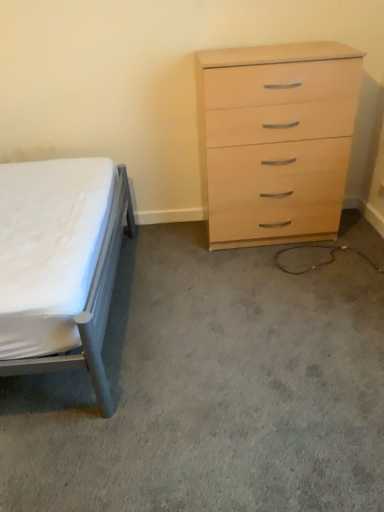
Measure the distance between point [219,254] and camera.

The depth of point [219,254] is 8.20 feet.

Where is `matte gray bed at left`? matte gray bed at left is located at coordinates (60, 264).

Where is `light wood/veneer chest of drawers at right`? Image resolution: width=384 pixels, height=512 pixels. light wood/veneer chest of drawers at right is located at coordinates (278, 134).

From the image's perspective, does light wood/veneer chest of drawers at right appear lower than matte gray bed at left?

Actually, light wood/veneer chest of drawers at right appears above matte gray bed at left in the image.

Considering the relative sizes of light wood/veneer chest of drawers at right and matte gray bed at left in the image provided, is light wood/veneer chest of drawers at right thinner than matte gray bed at left?

Yes, light wood/veneer chest of drawers at right is thinner than matte gray bed at left.

From a real-world perspective, between light wood/veneer chest of drawers at right and matte gray bed at left, who is vertically lower?

matte gray bed at left is physically lower.

Measure the distance from matte gray bed at left to white fabric bed at left.

They are 20.34 inches apart.

Is matte gray bed at left facing away from white fabric bed at left?

No, matte gray bed at left is not facing away from white fabric bed at left.

I want to click on bed in front of the white fabric bed at left, so click(x=60, y=264).

Considering the positions of objects matte gray bed at left and white fabric bed at left in the image provided, who is in front, matte gray bed at left or white fabric bed at left?

matte gray bed at left is in front.

From a real-world perspective, which object rests below the other?

matte gray bed at left is physically lower.

Which object is thinner, matte gray bed at left or light wood/veneer chest of drawers at right?

light wood/veneer chest of drawers at right.

Which point is more distant from viewer, (45,236) or (342,183)?

Point (342,183)

Is matte gray bed at left in front of or behind light wood/veneer chest of drawers at right in the image?

Visually, matte gray bed at left is located in front of light wood/veneer chest of drawers at right.

Is white fabric bed at left taller than light wood/veneer chest of drawers at right?

In fact, white fabric bed at left may be shorter than light wood/veneer chest of drawers at right.

What are the coordinates of `concrete below the light wood/veneer chest of drawers at right (from the image's perspective)` in the screenshot? It's located at (211, 390).

Considering the points (340, 296) and (228, 132), which point is in front, point (340, 296) or point (228, 132)?

The point (340, 296) is more forward.

Based on the photo, is white fabric bed at left facing away from matte gray bed at left?

That's not correct — white fabric bed at left is not looking away from matte gray bed at left.

Which is correct: white fabric bed at left is inside matte gray bed at left, or outside of it?

white fabric bed at left is not inside matte gray bed at left, it's outside.

Considering the sizes of objects white fabric bed at left and matte gray bed at left in the image provided, who is thinner, white fabric bed at left or matte gray bed at left?

matte gray bed at left.

Based on the photo, does white fabric bed at left touch matte gray bed at left?

No, white fabric bed at left is not beside matte gray bed at left.

Which of these two, light wood/veneer chest of drawers at right or white fabric bed at left, stands shorter?

white fabric bed at left is shorter.

Is point (309, 186) closer or farther from the camera than point (25, 505)?

Point (309, 186) is positioned farther from the camera compared to point (25, 505).

Is light wood/veneer chest of drawers at right further to the viewer compared to white fabric bed at left?

Yes, the depth of light wood/veneer chest of drawers at right is greater than that of white fabric bed at left.

At what (x,y) coordinates should I click in order to perform the action: click on bed located underneath the light wood/veneer chest of drawers at right (from a real-world perspective). Please return your answer as a coordinate pair (x, y). Looking at the image, I should click on (60, 264).

What are the coordinates of `concrete on the right of matte gray bed at left` in the screenshot? It's located at (211, 390).

From the image, which object appears to be nearer to matte gray bed at left, white fabric bed at left or light wood/veneer chest of drawers at right?

white fabric bed at left is closer to matte gray bed at left.

Looking at the image, which one is located further to light wood/veneer chest of drawers at right, matte gray bed at left or white fabric bed at left?

matte gray bed at left.

Considering their positions, is matte gray bed at left positioned further to white fabric bed at left than light wood/veneer chest of drawers at right?

The object further to white fabric bed at left is light wood/veneer chest of drawers at right.

Consider the image. Looking at the image, which one is located further to light wood/veneer chest of drawers at right, white fabric bed at left or matte gray bed at left?

matte gray bed at left is positioned further to the anchor light wood/veneer chest of drawers at right.

Based on their spatial positions, is light wood/veneer chest of drawers at right or matte gray bed at left further from white fabric bed at left?

light wood/veneer chest of drawers at right lies further to white fabric bed at left than the other object.

Looking at the image, which one is located closer to matte gray bed at left, light wood/veneer chest of drawers at right or white fabric bed at left?

Based on the image, white fabric bed at left appears to be nearer to matte gray bed at left.

What are the coordinates of `concrete between matte gray bed at left and light wood/veneer chest of drawers at right from left to right` in the screenshot? It's located at (211, 390).